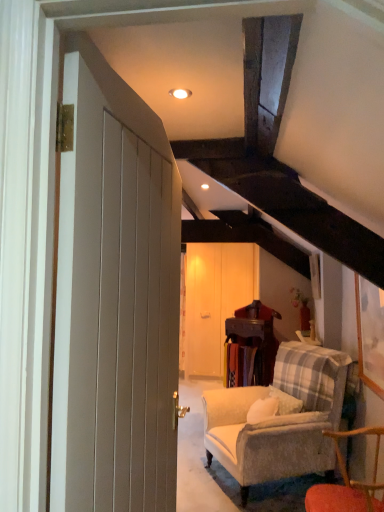
This screenshot has width=384, height=512. What do you see at coordinates (115, 301) in the screenshot?
I see `matte white door at left` at bounding box center [115, 301].

The width and height of the screenshot is (384, 512). Identify the location of plush beige couch at center. (279, 419).

Identify the location of wooden barn door at center. This screenshot has width=384, height=512. (214, 300).

You are a GUI agent. You are given a task and a screenshot of the screen. Output one action in this format:
    pyautogui.click(x=<x>, y=<y>)
    Task: Click on the matte white door at left
    
    Given the screenshot: What is the action you would take?
    pyautogui.click(x=115, y=301)

Considering the relative sizes of wooden barn door at center and wooden chair at lower right in the image provided, is wooden barn door at center taller than wooden chair at lower right?

Yes, wooden barn door at center is taller than wooden chair at lower right.

Consider the image. Considering the relative sizes of wooden barn door at center and wooden chair at lower right in the image provided, is wooden barn door at center smaller than wooden chair at lower right?

No.

From the image's perspective, is wooden barn door at center positioned above or below wooden chair at lower right?

From the image's perspective, wooden barn door at center appears above wooden chair at lower right.

The width and height of the screenshot is (384, 512). I want to click on door lying above the plush beige couch at center (from the image's perspective), so click(115, 301).

Is plush beige couch at center to the left or to the right of matte white door at left in the image?

From the image, it's evident that plush beige couch at center is to the right of matte white door at left.

Does plush beige couch at center come in front of matte white door at left?

No, plush beige couch at center is further to the viewer.

From the image's perspective, is plush beige couch at center under matte white door at left?

Yes, from the image's perspective, plush beige couch at center is beneath matte white door at left.

Is matte white door at left placed right next to wooden chair at lower right?

matte white door at left and wooden chair at lower right are clearly separated.

From a real-world perspective, which object stands above the other?

In real-world perspective, matte white door at left is above.

I want to click on chair below the matte white door at left (from the image's perspective), so click(347, 483).

Between matte white door at left and wooden chair at lower right, which one has smaller width?

matte white door at left.

Would you say matte white door at left is outside wooden barn door at center?

Yes, matte white door at left is outside of wooden barn door at center.

Considering the sizes of objects matte white door at left and wooden barn door at center in the image provided, who is taller, matte white door at left or wooden barn door at center?

wooden barn door at center is taller.

Based on the photo, is matte white door at left in front of or behind wooden barn door at center in the image?

In the image, matte white door at left appears in front of wooden barn door at center.

Considering the positions of objects wooden barn door at center and wooden table at center in the image provided, who is in front, wooden barn door at center or wooden table at center?

wooden table at center.

Consider the image. From a real-world perspective, is wooden barn door at center under wooden table at center?

No, from a real-world perspective, wooden barn door at center is not beneath wooden table at center.

Would you consider wooden barn door at center to be distant from wooden table at center?

That's not correct — wooden barn door at center is a little close to wooden table at center.

How much distance is there between wooden barn door at center and wooden table at center?

They are 28.11 inches apart.

Is wooden chair at lower right far away from wooden barn door at center?

Yes.

Is the depth of wooden chair at lower right greater than that of wooden barn door at center?

No, the depth of wooden chair at lower right is less than that of wooden barn door at center.

From the image's perspective, is wooden chair at lower right located beneath wooden barn door at center?

Correct, wooden chair at lower right appears lower than wooden barn door at center in the image.

From a real-world perspective, is wooden chair at lower right physically below wooden barn door at center?

Indeed, from a real-world perspective, wooden chair at lower right is positioned beneath wooden barn door at center.

Considering the relative sizes of wooden table at center and plush beige couch at center in the image provided, is wooden table at center smaller than plush beige couch at center?

Yes, wooden table at center is smaller than plush beige couch at center.

Could you tell me if wooden table at center is turned towards plush beige couch at center?

No, wooden table at center is not facing towards plush beige couch at center.

Is wooden table at center not inside plush beige couch at center?

Absolutely, wooden table at center is external to plush beige couch at center.

Where is `barn door lying behind the wooden chair at lower right`? barn door lying behind the wooden chair at lower right is located at coordinates (214, 300).

This screenshot has height=512, width=384. Find the location of `studio couch below the matte white door at left (from a real-world perspective)`. studio couch below the matte white door at left (from a real-world perspective) is located at coordinates (279, 419).

Based on their spatial positions, is wooden barn door at center or matte white door at left closer to plush beige couch at center?

Based on the image, wooden barn door at center appears to be nearer to plush beige couch at center.

From the image, which object appears to be farther from wooden table at center, wooden barn door at center or plush beige couch at center?

The object further to wooden table at center is plush beige couch at center.

Which object lies further to the anchor point wooden table at center, plush beige couch at center or matte white door at left?

matte white door at left is positioned further to the anchor wooden table at center.

Looking at the image, which one is located further to wooden table at center, matte white door at left or wooden chair at lower right?

matte white door at left is further to wooden table at center.

Which object lies further to the anchor point plush beige couch at center, wooden barn door at center or wooden chair at lower right?

Based on the image, wooden barn door at center appears to be further to plush beige couch at center.

Considering their positions, is matte white door at left positioned closer to plush beige couch at center than wooden table at center?

wooden table at center is positioned closer to the anchor plush beige couch at center.

When comparing their distances from plush beige couch at center, does wooden chair at lower right or wooden table at center seem closer?

The object closer to plush beige couch at center is wooden table at center.

Looking at the image, which one is located further to plush beige couch at center, wooden table at center or wooden chair at lower right?

Among the two, wooden chair at lower right is located further to plush beige couch at center.

Locate an element on the screen. chair between matte white door at left and wooden barn door at center from front to back is located at coordinates (347, 483).

The image size is (384, 512). Identify the location of studio couch between matte white door at left and wooden barn door at center along the z-axis. (279, 419).

Find the location of a particular element. Image resolution: width=384 pixels, height=512 pixels. studio couch located between wooden chair at lower right and wooden barn door at center in the depth direction is located at coordinates (279, 419).

Where is `table between matte white door at left and wooden barn door at center in the front-back direction`? The image size is (384, 512). table between matte white door at left and wooden barn door at center in the front-back direction is located at coordinates (254, 346).